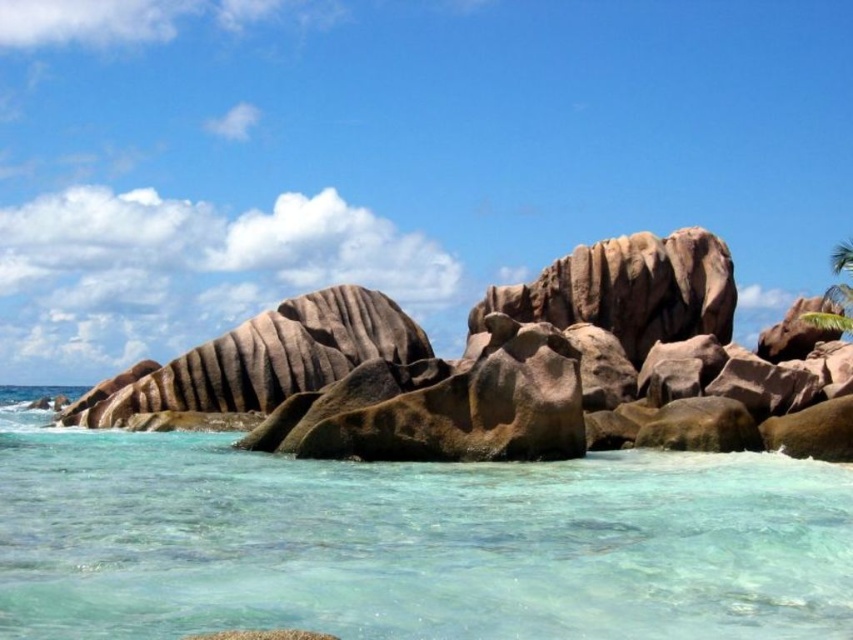
You are standing on the rugged granite boulders in the coastal scene. You see a point marked at coordinates point (413, 541). Is this point located on the clear glassy water at lower center?

Yes, the point (413, 541) is on the clear glassy water at lower center according to the description.

You are standing on the beach and see the brown textured rock at center and the green leafy palm tree at upper right. Which object is closer to you?

The brown textured rock at center is closer to you because it is in front of the green leafy palm tree at upper right.